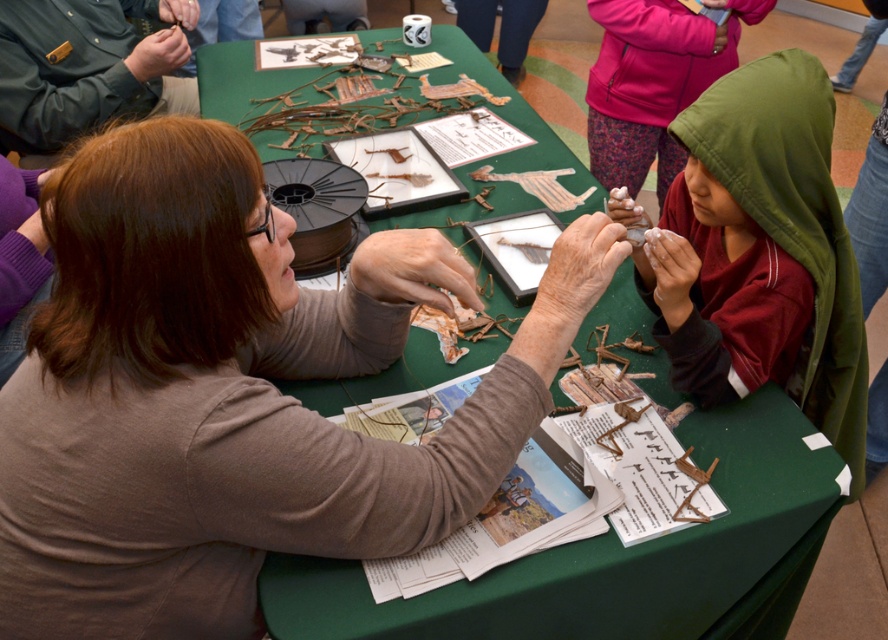
Find the location of a particular element. The height and width of the screenshot is (640, 888). green uniform at upper left is located at coordinates (86, 68).

Is green uniform at upper left further to camera compared to green hooded sweatshirt at upper right?

No.

Between point (111, 83) and point (680, 65), which one is positioned in front?

Point (111, 83) is in front.

At what (x,y) coordinates should I click in order to perform the action: click on green uniform at upper left. Please return your answer as a coordinate pair (x, y). Looking at the image, I should click on (86, 68).

Who is shorter, green fabric table at center or green hooded sweatshirt at upper right?

green hooded sweatshirt at upper right is shorter.

Is green fabric table at center above green hooded sweatshirt at upper right?

Incorrect, green fabric table at center is not positioned above green hooded sweatshirt at upper right.

Who is more forward, (756, 593) or (706, 19)?

Point (756, 593) is more forward.

Where is `green fabric table at center`? This screenshot has height=640, width=888. green fabric table at center is located at coordinates (616, 557).

Does brown textured paper at center appear on the left side of green uniform at upper left?

→ No, brown textured paper at center is not to the left of green uniform at upper left.

I want to click on brown textured paper at center, so [x=232, y=394].

The height and width of the screenshot is (640, 888). I want to click on brown textured paper at center, so click(232, 394).